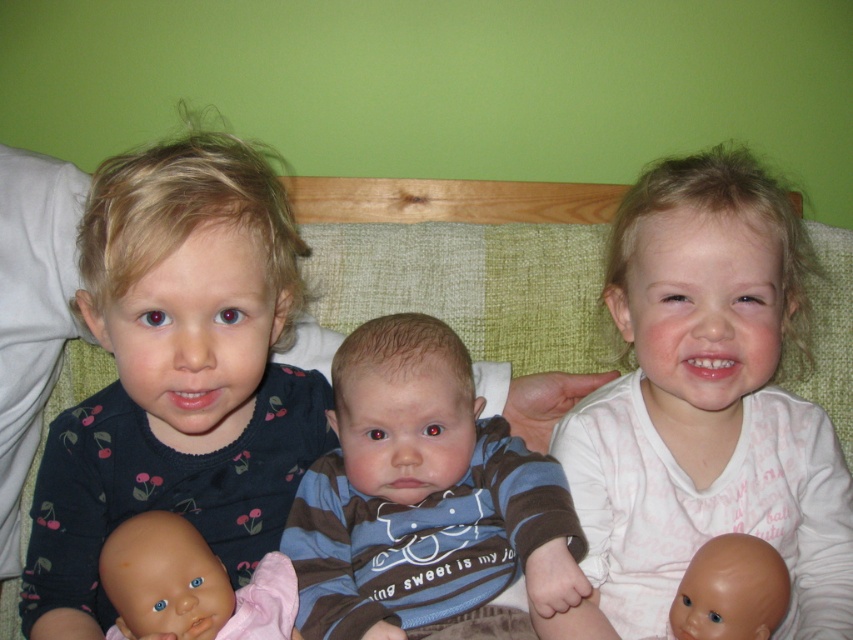
Question: Is dark blue jersey at left positioned in front of smooth plastic doll at lower left?

Choices:
 (A) yes
 (B) no

Answer: (A)

Question: Can you confirm if dark blue jersey at left is positioned to the left of smooth plastic doll at lower right?

Choices:
 (A) no
 (B) yes

Answer: (B)

Question: Which of the following is the farthest from the observer?

Choices:
 (A) striped cotton shirt at center
 (B) white soft fabric at upper right

Answer: (B)

Question: Which point appears closest to the camera in this image?

Choices:
 (A) (724, 582)
 (B) (335, 413)

Answer: (A)

Question: Can you confirm if white soft fabric at upper right is smaller than striped cotton shirt at center?

Choices:
 (A) no
 (B) yes

Answer: (A)

Question: Which of the following is the farthest from the observer?

Choices:
 (A) smooth plastic doll at lower left
 (B) smooth plastic doll at lower right

Answer: (B)